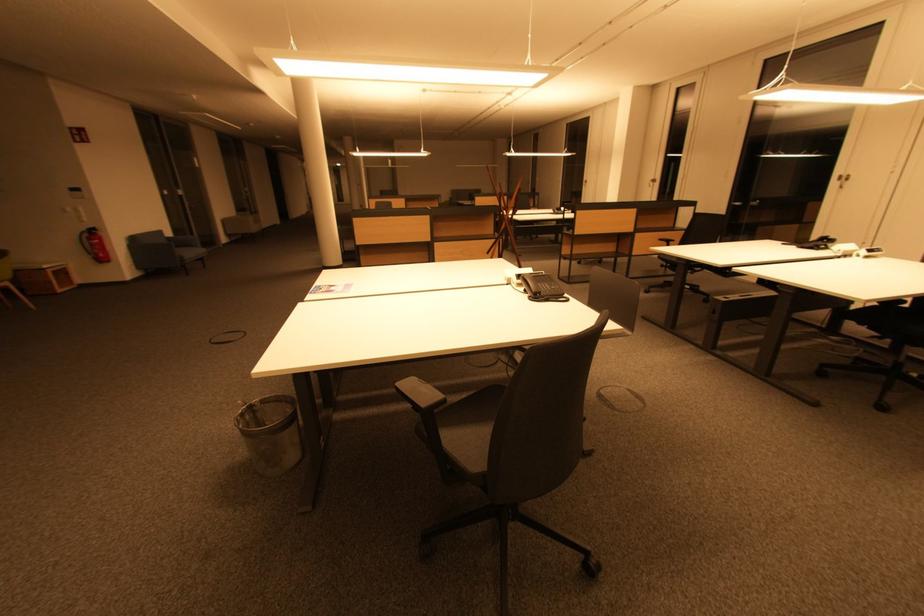
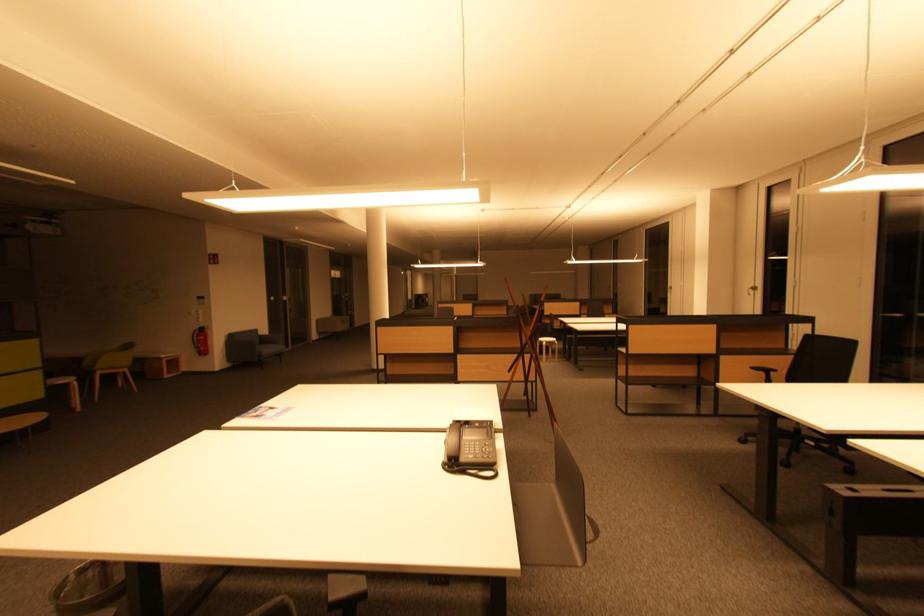
What movement of the cameraman would produce the second image?

The movement direction of the cameraman is right, forward.